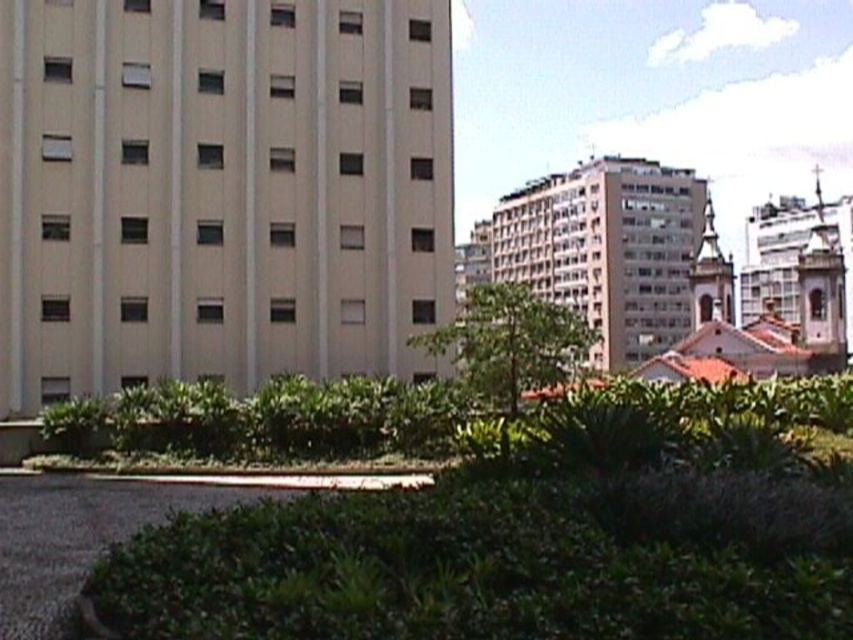
You are standing at the center of the image and want to locate the beige smooth building at left. What are its coordinates?

The beige smooth building at left is located at coordinates point (x=219, y=189).

You are standing at the center of the image. Which direction should you face to look directly at the beige smooth building at left?

You should face to the left to look directly at the beige smooth building at left since it is located at the left side of the image.

From the picture: You are an architect planning to add a new structure to the urban landscape. You want to ensure that the new structure does not overshadow the existing landmarks. Given the white stone church at upper right and the gold textured church steeple at upper right, which of these two should you consider as the primary reference for size to maintain proportion?

The white stone church at upper right is larger in size than the gold textured church steeple at upper right, so you should consider the white stone church at upper right as the primary reference for size to maintain proportion.